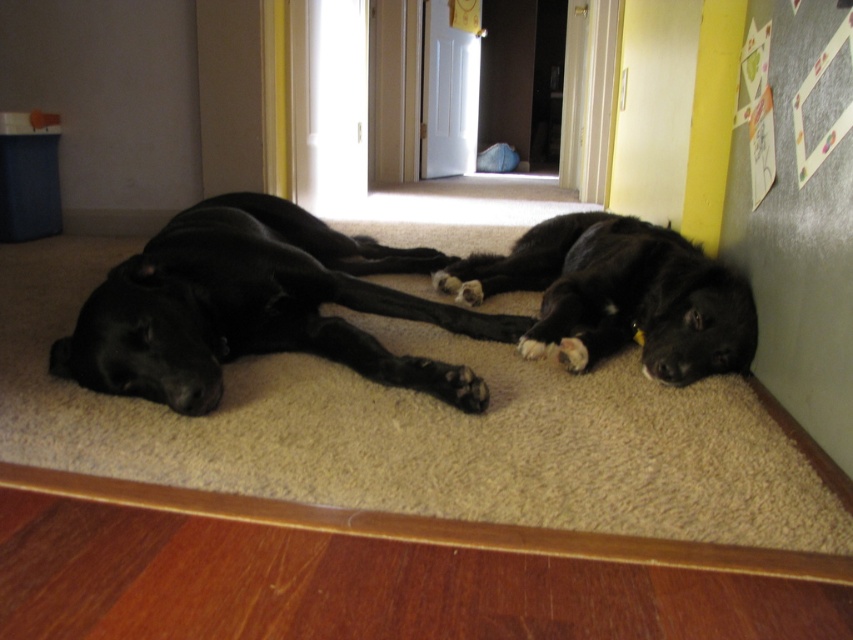
Question: Which point is closer to the camera taking this photo?

Choices:
 (A) (798, 204)
 (B) (485, 227)
 (C) (94, 378)
 (D) (573, 275)

Answer: (A)

Question: Observing the image, what is the correct spatial positioning of black smooth dog at center in reference to black matte dog at lower right?

Choices:
 (A) below
 (B) above

Answer: (B)

Question: Can you confirm if black smooth dog at center is thinner than black matte dog at lower right?

Choices:
 (A) no
 (B) yes

Answer: (A)

Question: Which point appears closest to the camera in this image?

Choices:
 (A) (238, 451)
 (B) (590, 236)

Answer: (A)

Question: Does black smooth dog at center have a greater width compared to black matte dog at lower right?

Choices:
 (A) yes
 (B) no

Answer: (A)

Question: Which point is farther to the camera?

Choices:
 (A) black smooth dog at center
 (B) beige carpet at center
 (C) white paperboard at lower right
 (D) black matte dog at lower right

Answer: (D)